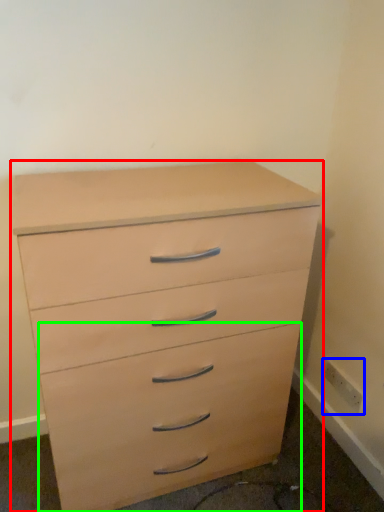
Question: Estimate the real-world distances between objects in this image. Which object is closer to chest of drawers (highlighted by a red box), electric outlet (highlighted by a blue box) or drawer (highlighted by a green box)?

Choices:
 (A) electric outlet
 (B) drawer

Answer: (B)